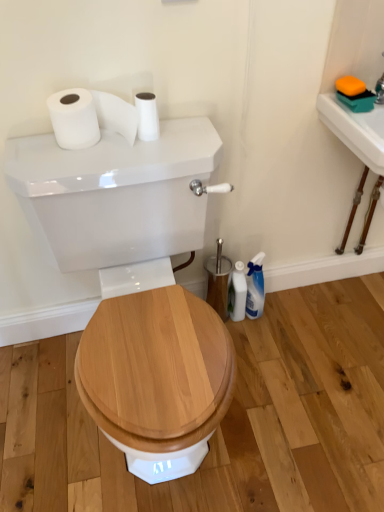
Question: From a real-world perspective, is white glossy toilet brush at lower right located beneath white matte toilet paper at upper center, which is counted as the second toilet paper, starting from the left?

Choices:
 (A) no
 (B) yes

Answer: (B)

Question: Considering the relative positions of white glossy toilet brush at lower right and white matte toilet paper at upper center, which is counted as the second toilet paper, starting from the left, in the image provided, is white glossy toilet brush at lower right to the left of white matte toilet paper at upper center, which is counted as the second toilet paper, starting from the left, from the viewer's perspective?

Choices:
 (A) yes
 (B) no

Answer: (B)

Question: Is white glossy toilet brush at lower right closer to camera compared to white matte toilet paper at upper center, the first toilet paper positioned from the right?

Choices:
 (A) no
 (B) yes

Answer: (A)

Question: Considering the relative sizes of white glossy toilet brush at lower right and white matte toilet paper at upper center, which is counted as the second toilet paper, starting from the left, in the image provided, is white glossy toilet brush at lower right wider than white matte toilet paper at upper center, which is counted as the second toilet paper, starting from the left,?

Choices:
 (A) no
 (B) yes

Answer: (A)

Question: Does white glossy toilet brush at lower right have a lesser width compared to white matte toilet paper at upper center, the first toilet paper positioned from the right?

Choices:
 (A) no
 (B) yes

Answer: (B)

Question: Does white glossy toilet brush at lower right come behind white matte toilet paper at upper center, which is counted as the second toilet paper, starting from the left?

Choices:
 (A) no
 (B) yes

Answer: (B)

Question: Is white matte toilet paper at upper center, the first toilet paper positioned from the right, behind white glossy toilet tank at center?

Choices:
 (A) yes
 (B) no

Answer: (A)

Question: From the image's perspective, is white matte toilet paper at upper center, the first toilet paper positioned from the right, under white glossy toilet tank at center?

Choices:
 (A) yes
 (B) no

Answer: (B)

Question: Are white matte toilet paper at upper center, which is counted as the second toilet paper, starting from the left, and white glossy toilet tank at center located far from each other?

Choices:
 (A) no
 (B) yes

Answer: (A)

Question: Does white matte toilet paper at upper center, which is counted as the second toilet paper, starting from the left, have a smaller size compared to white glossy toilet tank at center?

Choices:
 (A) yes
 (B) no

Answer: (A)

Question: Would you say white glossy toilet tank at center is part of white matte toilet paper at upper center, which is counted as the second toilet paper, starting from the left,'s contents?

Choices:
 (A) yes
 (B) no

Answer: (B)

Question: From a real-world perspective, is white matte toilet paper at upper center, the first toilet paper positioned from the right, on top of white glossy toilet tank at center?

Choices:
 (A) yes
 (B) no

Answer: (A)

Question: Considering the relative positions of white glossy toilet tank at center and white glossy sink at upper right in the image provided, is white glossy toilet tank at center behind white glossy sink at upper right?

Choices:
 (A) no
 (B) yes

Answer: (A)